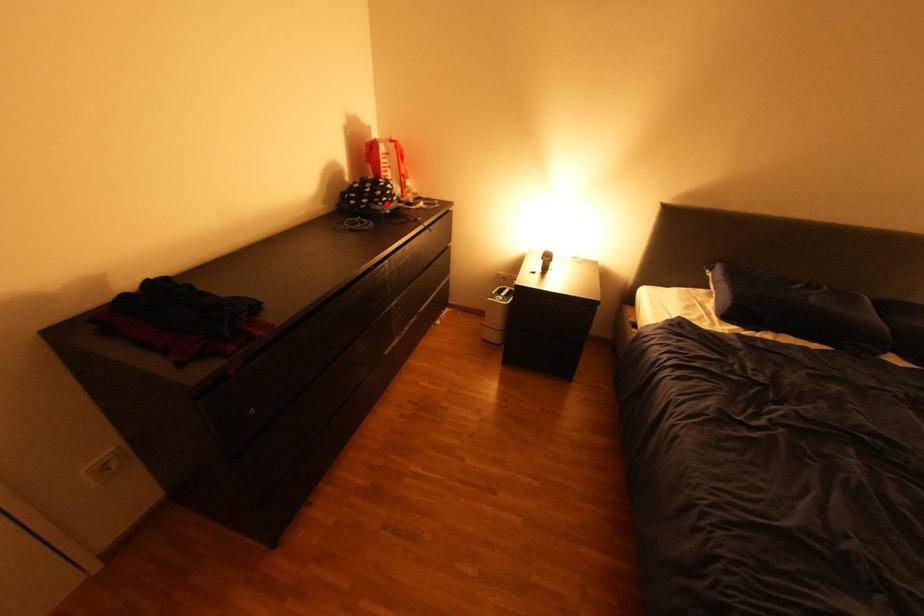
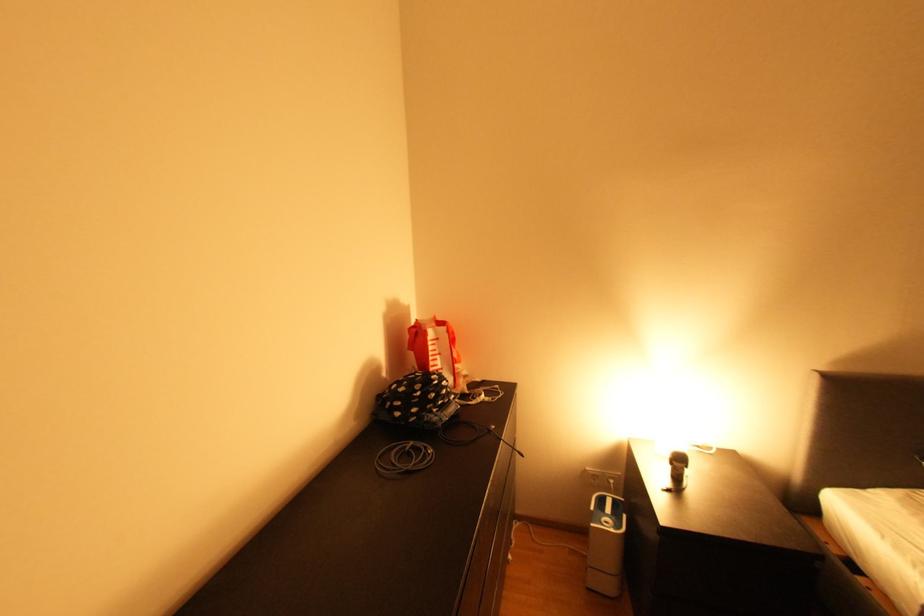
Question: I am providing you with two images of the same scene from different viewpoints. Image1 has a red point marked. In image2, the corresponding 3D location appears at what relative position? Reply with the corresponding letter.

Choices:
 (A) Closer
 (B) Farther

Answer: (B)